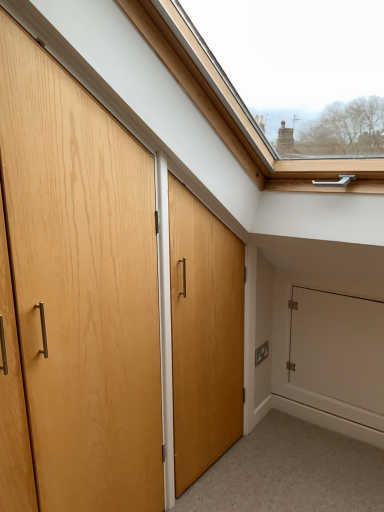
Question: Does matte wood door at left have a larger size compared to white matte door at lower right?

Choices:
 (A) no
 (B) yes

Answer: (B)

Question: Can you confirm if matte wood door at left is taller than white matte door at lower right?

Choices:
 (A) yes
 (B) no

Answer: (A)

Question: Is matte wood door at left looking in the opposite direction of white matte door at lower right?

Choices:
 (A) no
 (B) yes

Answer: (A)

Question: Is matte wood door at left positioned beyond the bounds of white matte door at lower right?

Choices:
 (A) yes
 (B) no

Answer: (A)

Question: Is matte wood door at left thinner than white matte door at lower right?

Choices:
 (A) no
 (B) yes

Answer: (A)

Question: Is matte wood door at left facing towards white matte door at lower right?

Choices:
 (A) yes
 (B) no

Answer: (B)

Question: Is white matte door at lower right positioned with its back to matte wood door at left?

Choices:
 (A) yes
 (B) no

Answer: (B)

Question: Considering the relative sizes of white matte door at lower right and matte wood door at left in the image provided, is white matte door at lower right bigger than matte wood door at left?

Choices:
 (A) no
 (B) yes

Answer: (A)

Question: From the image's perspective, is white matte door at lower right beneath matte wood door at left?

Choices:
 (A) yes
 (B) no

Answer: (A)

Question: From a real-world perspective, is white matte door at lower right under matte wood door at left?

Choices:
 (A) yes
 (B) no

Answer: (A)

Question: Could you tell me if white matte door at lower right is turned towards matte wood door at left?

Choices:
 (A) no
 (B) yes

Answer: (B)

Question: Is white matte door at lower right thinner than matte wood door at left?

Choices:
 (A) yes
 (B) no

Answer: (A)

Question: Is matte wood door at left bigger or smaller than white matte door at lower right?

Choices:
 (A) small
 (B) big

Answer: (B)